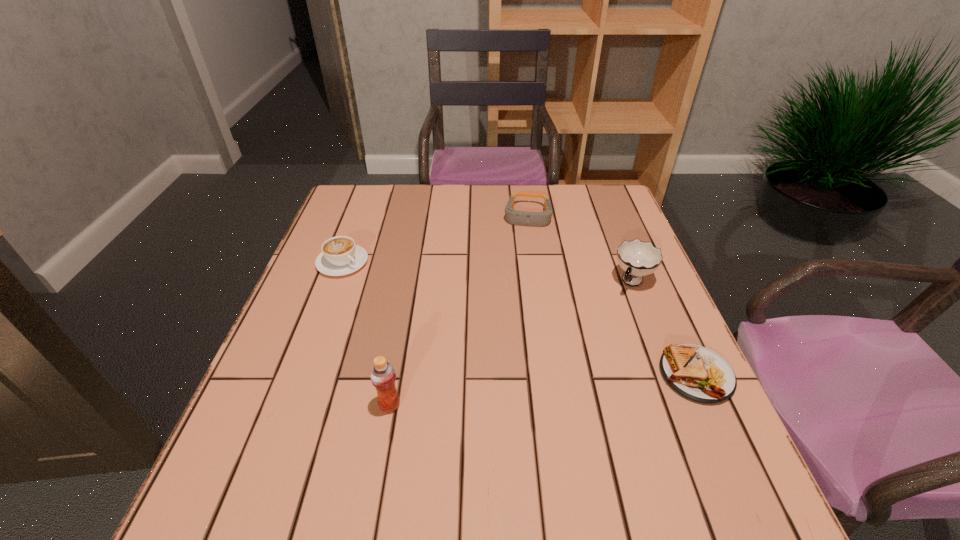
The height and width of the screenshot is (540, 960). What are the coordinates of `orange juice` in the screenshot? It's located at [382, 374].

This screenshot has height=540, width=960. I want to click on the fourth object from right to left, so click(382, 374).

At what (x,y) coordinates should I click in order to perform the action: click on the shortest object. Please return your answer as a coordinate pair (x, y). This screenshot has height=540, width=960. Looking at the image, I should click on (697, 373).

Identify the location of the leftmost object. The image size is (960, 540). (340, 256).

At what (x,y) coordinates should I click in order to perform the action: click on the farthest object. Please return your answer as a coordinate pair (x, y). This screenshot has width=960, height=540. Looking at the image, I should click on (520, 218).

Identify the location of the third object from left to right. (520, 218).

You are a GUI agent. You are given a task and a screenshot of the screen. Output one action in this format:
    pyautogui.click(x=<x>, y=<y>)
    Task: Click on the second tallest object
    The height and width of the screenshot is (540, 960).
    Given the screenshot: What is the action you would take?
    pyautogui.click(x=637, y=258)

The height and width of the screenshot is (540, 960). I want to click on vacant space located on the right of the orange juice, so click(x=584, y=405).

I want to click on free point located on the left of the sandwich, so click(x=587, y=374).

Locate an element on the screen. The image size is (960, 540). vacant area situated 0.080m on the side of the leftmost object with the handle is located at coordinates pyautogui.click(x=377, y=288).